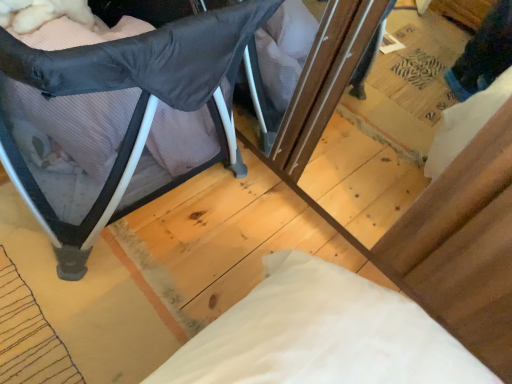
Question: Does matte black playpen at left have a greater height compared to pink striped pillow at left?

Choices:
 (A) no
 (B) yes

Answer: (B)

Question: Does matte black playpen at left have a larger size compared to pink striped pillow at left?

Choices:
 (A) no
 (B) yes

Answer: (B)

Question: From the image's perspective, is matte black playpen at left located above pink striped pillow at left?

Choices:
 (A) no
 (B) yes

Answer: (A)

Question: From a real-world perspective, is matte black playpen at left on top of pink striped pillow at left?

Choices:
 (A) yes
 (B) no

Answer: (A)

Question: Is matte black playpen at left far from pink striped pillow at left?

Choices:
 (A) no
 (B) yes

Answer: (A)

Question: Is matte black playpen at left wider than pink striped pillow at left?

Choices:
 (A) no
 (B) yes

Answer: (B)

Question: Considering the relative positions of pink striped pillow at left and matte black playpen at left in the image provided, is pink striped pillow at left to the right of matte black playpen at left from the viewer's perspective?

Choices:
 (A) no
 (B) yes

Answer: (B)

Question: Can you confirm if pink striped pillow at left is thinner than matte black playpen at left?

Choices:
 (A) yes
 (B) no

Answer: (A)

Question: Is pink striped pillow at left positioned with its back to matte black playpen at left?

Choices:
 (A) no
 (B) yes

Answer: (B)

Question: Could you tell me if pink striped pillow at left is turned towards matte black playpen at left?

Choices:
 (A) yes
 (B) no

Answer: (A)

Question: From the image's perspective, does pink striped pillow at left appear higher than matte black playpen at left?

Choices:
 (A) no
 (B) yes

Answer: (B)

Question: From the image's perspective, is pink striped pillow at left located beneath matte black playpen at left?

Choices:
 (A) yes
 (B) no

Answer: (B)

Question: Looking at their shapes, would you say pink striped pillow at left is wider or thinner than matte black playpen at left?

Choices:
 (A) thin
 (B) wide

Answer: (A)